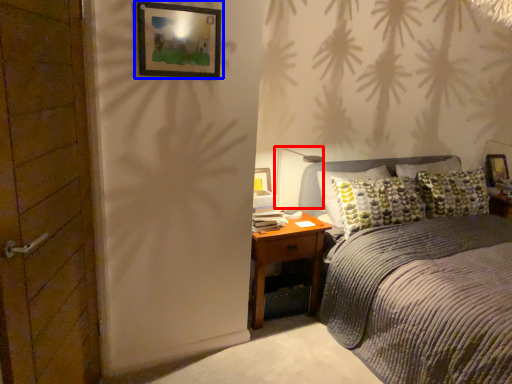
Question: Which object is further to the camera taking this photo, light fixture (highlighted by a red box) or picture frame (highlighted by a blue box)?

Choices:
 (A) light fixture
 (B) picture frame

Answer: (A)